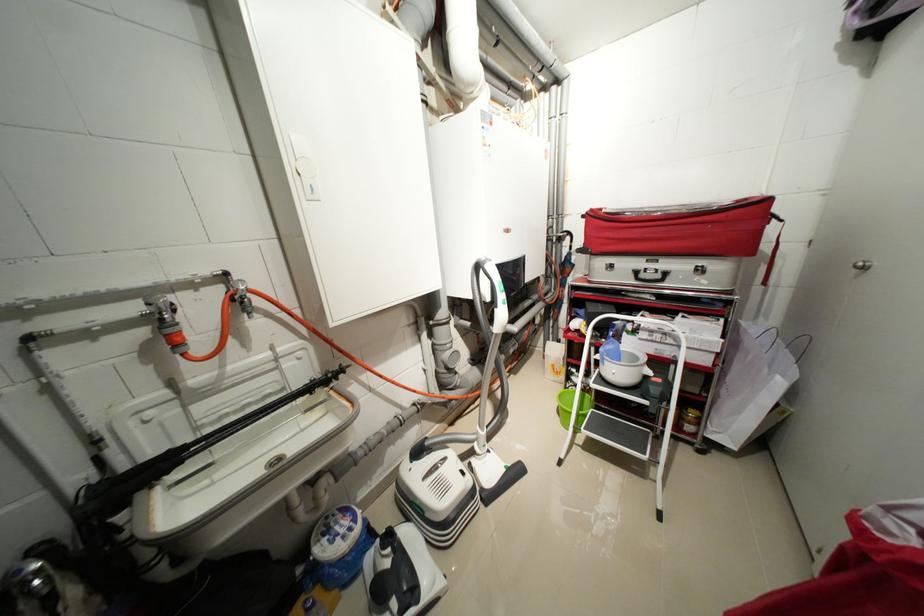
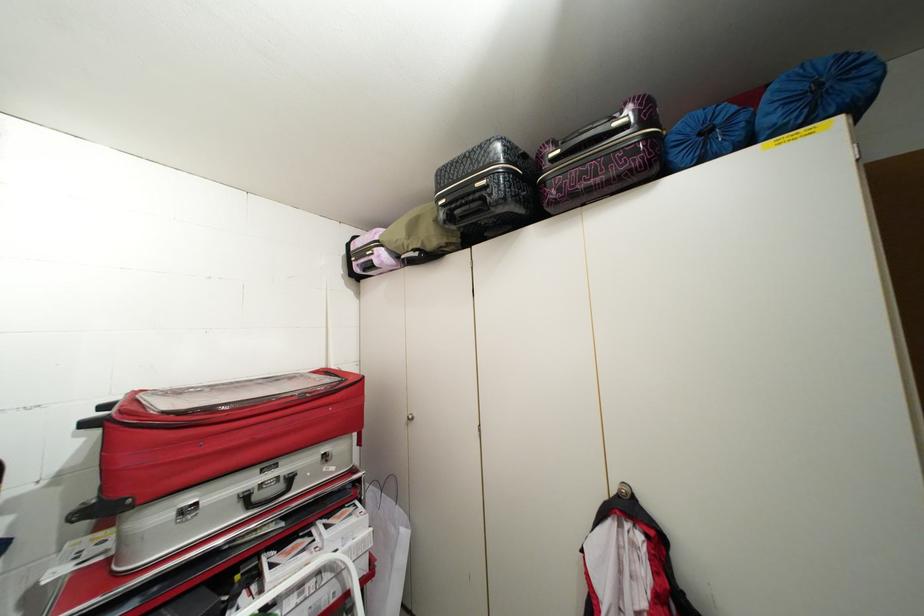
Question: The camera is either moving clockwise (left) or counter-clockwise (right) around the object. The first image is from the beginning of the video and the second image is from the end. Is the camera moving left or right when shooting the video?

Choices:
 (A) Left
 (B) Right

Answer: (A)